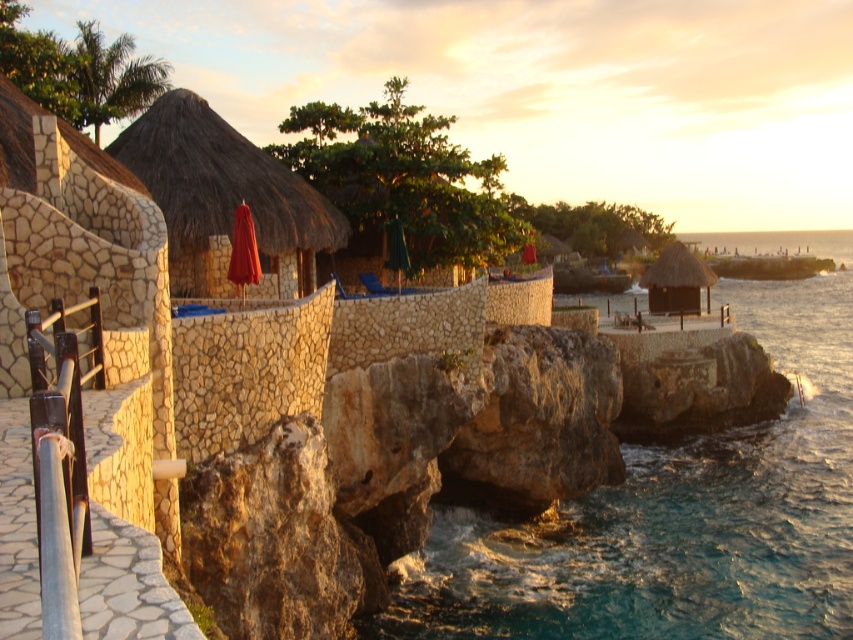
Is point (190, 144) closer to camera compared to point (399, 268)?

Yes.

What do you see at coordinates (225, 198) in the screenshot? I see `thatched straw hut at left` at bounding box center [225, 198].

Find the location of a particular element. This screenshot has height=640, width=853. thatched straw hut at left is located at coordinates (225, 198).

Between point (251, 260) and point (399, 221), which one is positioned behind?

Point (399, 221)

In the scene shown: Does matte red umbrella at center appear under green fabric umbrella at center?

Indeed, matte red umbrella at center is positioned under green fabric umbrella at center.

This screenshot has height=640, width=853. In order to click on matte red umbrella at center in this screenshot , I will do pos(242,252).

Can you confirm if thatched straw hut at center is positioned to the right of green fabric umbrella at center?

Yes, thatched straw hut at center is to the right of green fabric umbrella at center.

Can you confirm if thatched straw hut at center is shorter than green fabric umbrella at center?

No.

At what (x,y) coordinates should I click in order to perform the action: click on thatched straw hut at center. Please return your answer as a coordinate pair (x, y). Looking at the image, I should click on (676, 280).

Where is `thatched straw hut at center`? thatched straw hut at center is located at coordinates (676, 280).